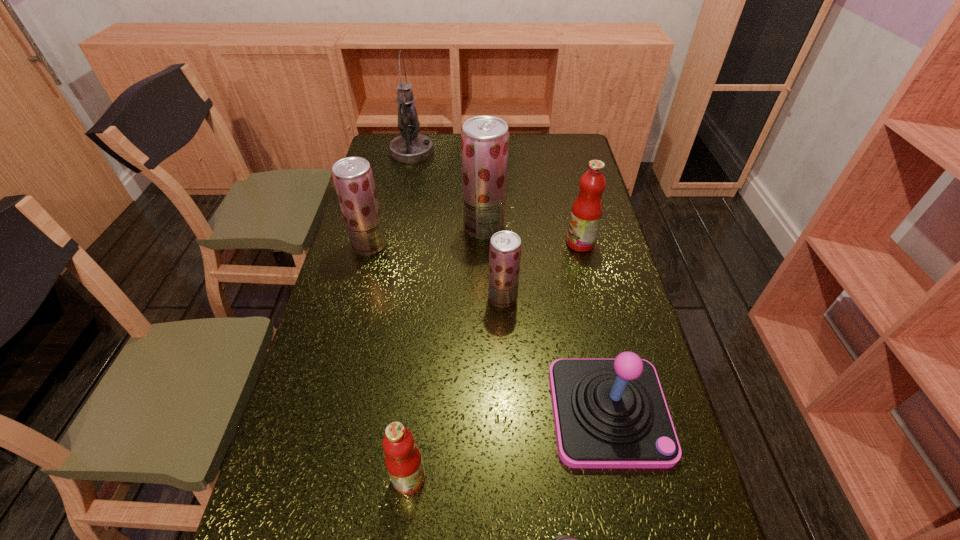
Find the location of a particular element. object that is positioned at the far edge is located at coordinates (410, 147).

Where is `oil lamp at the left edge`? oil lamp at the left edge is located at coordinates (410, 147).

Find the location of `fruit juice that is at the left edge`. fruit juice that is at the left edge is located at coordinates (353, 178).

In order to click on fruit juice at the right edge in this screenshot , I will do 587,209.

Find the location of a particular element. joystick at the right edge is located at coordinates (609, 413).

Where is `object at the far left corner`? The height and width of the screenshot is (540, 960). object at the far left corner is located at coordinates (410, 147).

Where is `vacant space at the far edge of the desktop`? The image size is (960, 540). vacant space at the far edge of the desktop is located at coordinates (458, 154).

In the image, there is a desktop. At what (x,y) coordinates should I click in order to perform the action: click on vacant space at the left edge. Please return your answer as a coordinate pair (x, y). The image size is (960, 540). Looking at the image, I should click on (327, 314).

Where is `blank space at the right edge of the desktop`? This screenshot has height=540, width=960. blank space at the right edge of the desktop is located at coordinates (661, 468).

Where is `free space at the far right corner of the desktop`? The width and height of the screenshot is (960, 540). free space at the far right corner of the desktop is located at coordinates (564, 152).